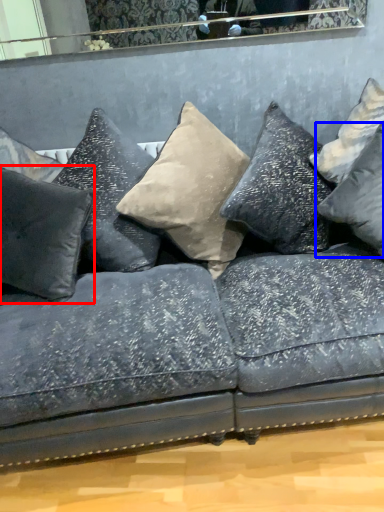
Question: Which object appears farthest to the camera in this image, pillow (highlighted by a red box) or pillow (highlighted by a blue box)?

Choices:
 (A) pillow
 (B) pillow

Answer: (A)